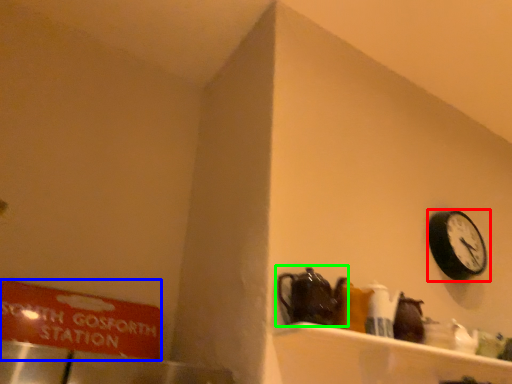
Question: Estimate the real-world distances between objects in this image. Which object is farther from wall clock (highlighted by a red box), sign (highlighted by a blue box) or tea pot (highlighted by a green box)?

Choices:
 (A) sign
 (B) tea pot

Answer: (A)